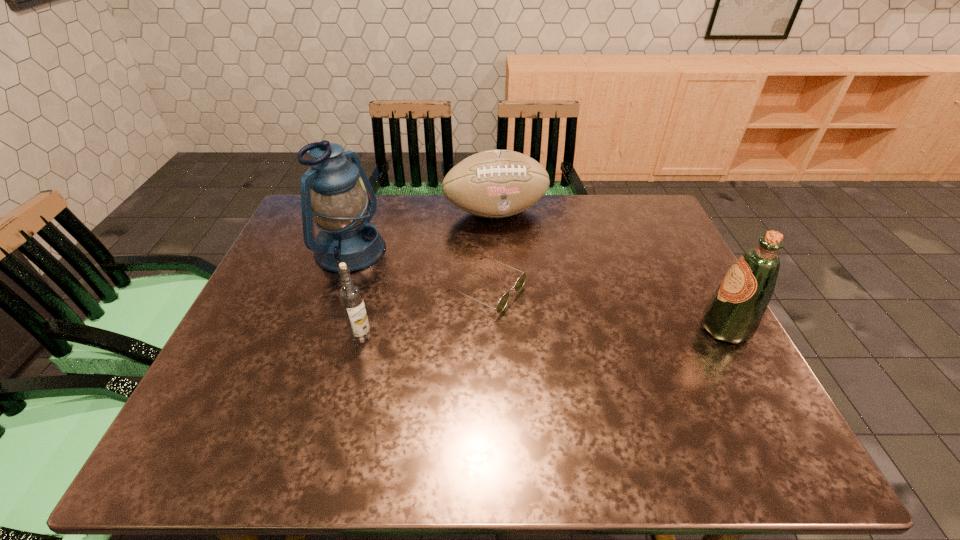
Where is `vacant space on the desktop that is between the vodka and the rightmost object and is positioned on the front-facing side of the shortest object`? Image resolution: width=960 pixels, height=540 pixels. vacant space on the desktop that is between the vodka and the rightmost object and is positioned on the front-facing side of the shortest object is located at coordinates (582, 332).

I want to click on vacant spot on the desktop that is between the vodka and the olive oil and is positioned on the face of the tallest object, so click(x=518, y=333).

You are a GUI agent. You are given a task and a screenshot of the screen. Output one action in this format:
    pyautogui.click(x=<x>, y=<y>)
    Task: Click on the free space on the desktop that is between the vodka and the olive oil and is positioned on the laces of the football (American)
    This screenshot has width=960, height=540.
    Given the screenshot: What is the action you would take?
    pyautogui.click(x=546, y=333)